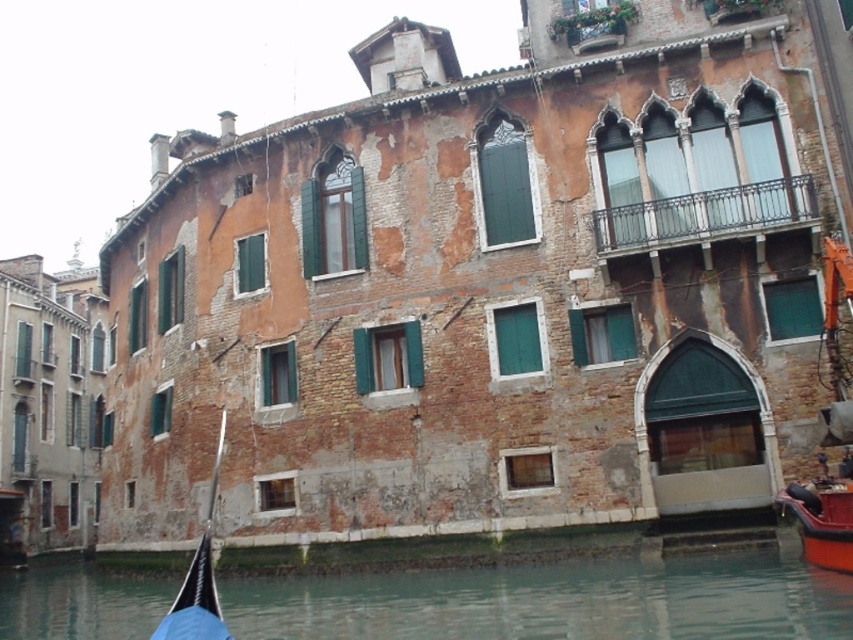
You are a tourist in Venice and want to take a photo of the clear water at lower center and the black fabric boat at lower left. Which object should you focus on first if you want to capture both in a single frame without moving the camera?

You should focus on the clear water at lower center first because it is larger in size than the black fabric boat at lower left, so it will occupy more space in the frame.

You are standing on the canal side in Venice, and you see a point marked at coordinates (x=552, y=600). According to the image, what does this point represent?

The point at (x=552, y=600) indicates clear water at lower center.